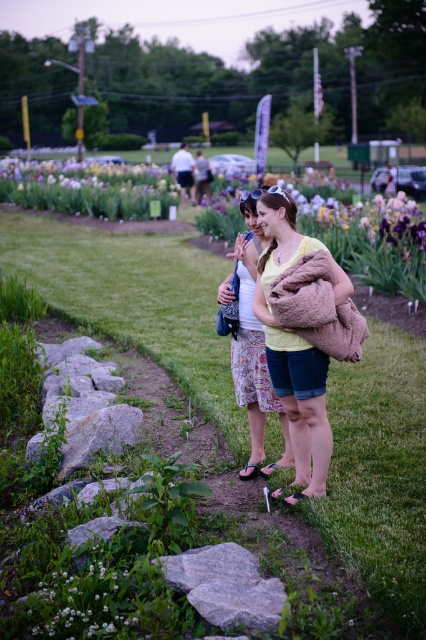
Is purple matte flowers at upper center wider than purple irises at upper left?

Correct, the width of purple matte flowers at upper center exceeds that of purple irises at upper left.

Is purple matte flowers at upper center thinner than purple irises at upper left?

No, purple matte flowers at upper center is not thinner than purple irises at upper left.

I want to click on purple matte flowers at upper center, so click(x=86, y=188).

Between light brown fuzzy coat at center and purple irises at upper left, which one appears on the right side from the viewer's perspective?

Positioned to the right is light brown fuzzy coat at center.

Can you confirm if light brown fuzzy coat at center is wider than purple irises at upper left?

No.

Is point (307, 417) farther from camera compared to point (147, 168)?

No.

I want to click on light brown fuzzy coat at center, so click(x=296, y=346).

This screenshot has height=640, width=426. Describe the element at coordinates (85, 604) in the screenshot. I see `white matte flower at lower left` at that location.

From the picture: Does white matte flower at lower left have a greater height compared to purple irises at upper left?

Incorrect, white matte flower at lower left's height is not larger of purple irises at upper left's.

Where is `white matte flower at lower left`? The height and width of the screenshot is (640, 426). white matte flower at lower left is located at coordinates (85, 604).